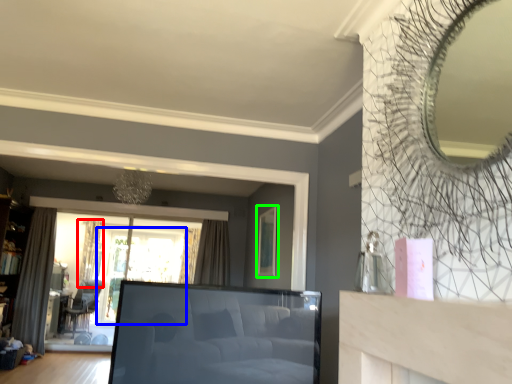
Question: Based on their relative distances, which object is nearer to curtain (highlighted by a red box)? Choose from window screen (highlighted by a blue box) and picture frame (highlighted by a green box).

Choices:
 (A) window screen
 (B) picture frame

Answer: (A)